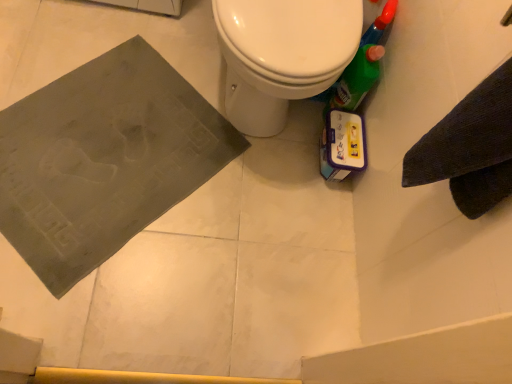
Locate an element on the screen. The image size is (512, 384). vacant space positioned to the left of dark gray rubber mat at lower left is located at coordinates (44, 57).